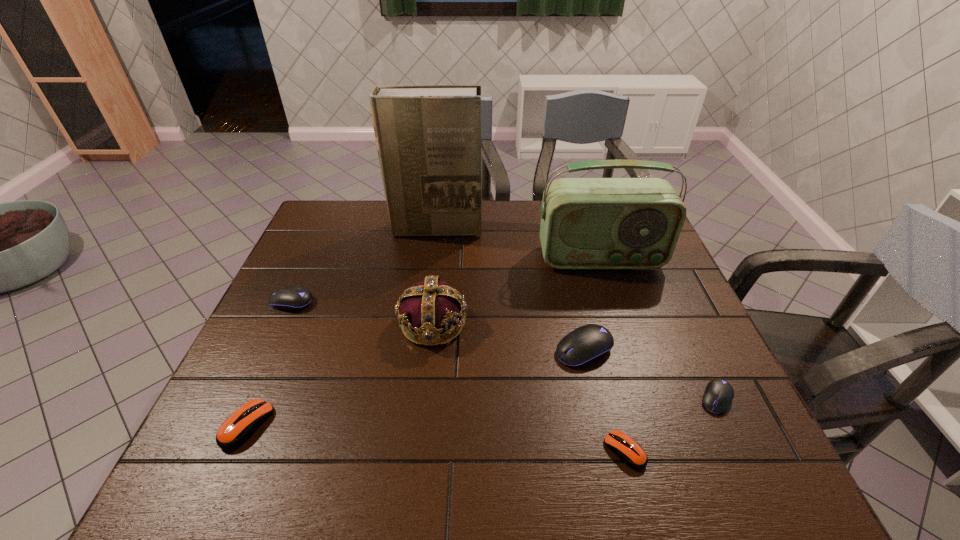
Identify the location of the bigger orange computer mouse. (241, 425).

At what (x,y) coordinates should I click in order to perform the action: click on the rightmost computer mouse. Please return your answer as a coordinate pair (x, y). This screenshot has height=540, width=960. Looking at the image, I should click on (718, 395).

At what (x,y) coordinates should I click in order to perform the action: click on the rightmost black computer mouse. Please return your answer as a coordinate pair (x, y). Looking at the image, I should click on (718, 395).

Locate an element on the screen. the shortest computer mouse is located at coordinates click(x=630, y=452).

Identify the location of the right orange computer mouse. This screenshot has height=540, width=960. (630, 452).

Identify the location of vacant space located 0.200m on the cover of the farthest object. This screenshot has height=540, width=960. (430, 279).

Where is `free spot located on the front panel of the second farthest object`? Image resolution: width=960 pixels, height=540 pixels. free spot located on the front panel of the second farthest object is located at coordinates (631, 351).

I want to click on vacant space located on the front of the sixth shortest object, so click(422, 415).

This screenshot has height=540, width=960. Identify the location of vacant region located on the left of the second black computer mouse from right to left. (452, 350).

Find the location of a particular element. free space located on the front of the leftmost black computer mouse is located at coordinates (263, 363).